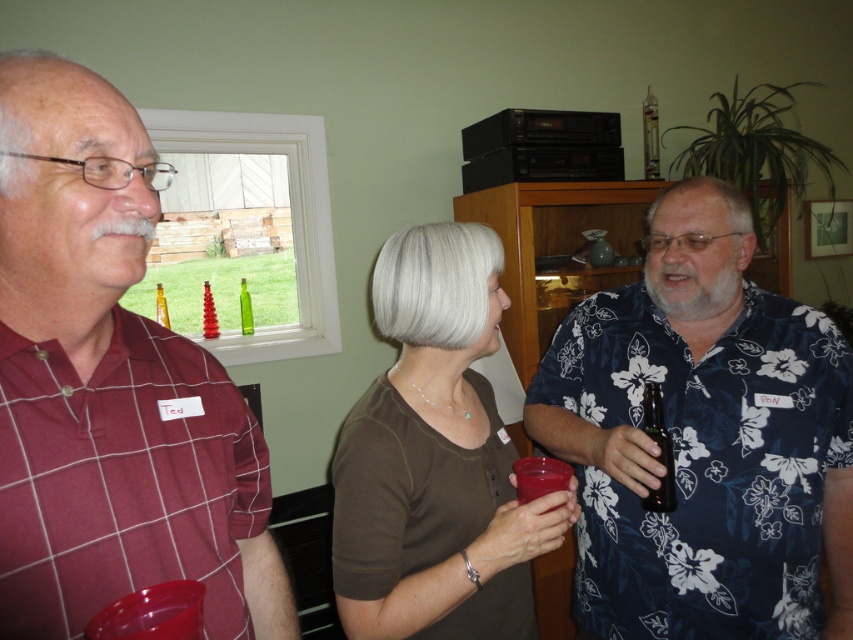
You are at a party and want to pour drinks for your friends. You see the black glass bottle at right and the translucent glass bottle at center. Which bottle can hold more liquid?

The black glass bottle at right is bigger than the translucent glass bottle at center, so it can hold more liquid.

You are at a party and want to hand a drink to the person wearing the blue floral shirt at center. The clear glass bottle at upper center is in your way. Can you move the bottle to the right to make space?

The blue floral shirt at center is positioned on the left side of the clear glass bottle at upper center, so moving the clear glass bottle at upper center to the right would create space between them, allowing you to hand the drink to the person wearing the blue floral shirt at center.